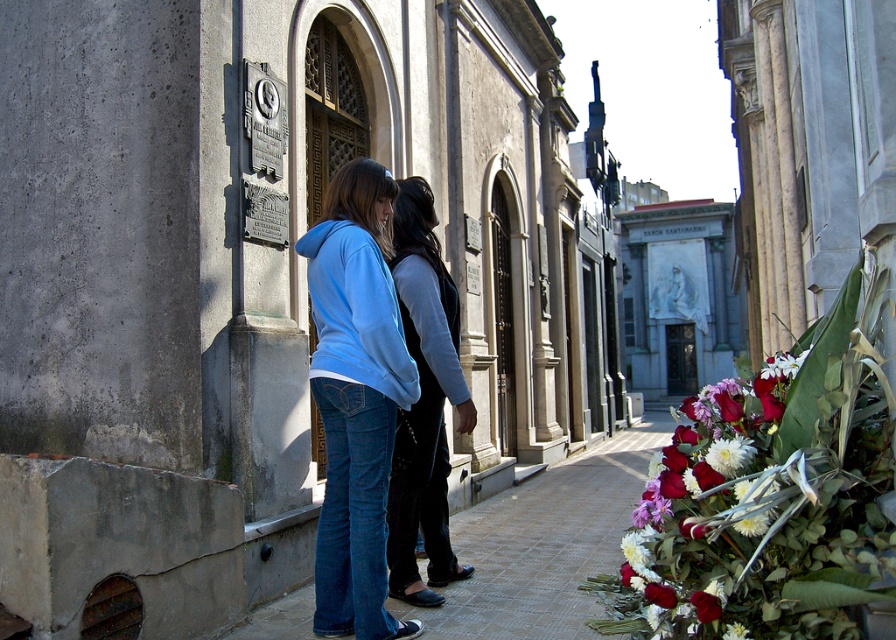
Can you confirm if denim jeans at center is positioned to the right of black leather jacket at center?

Yes, denim jeans at center is to the right of black leather jacket at center.

Who is positioned more to the left, denim jeans at center or black leather jacket at center?

black leather jacket at center is more to the left.

Is point (586, 497) behind point (448, 515)?

That is True.

This screenshot has height=640, width=896. Identify the location of denim jeans at center. (544, 544).

Who is more distant from viewer, (448, 348) or (341, 308)?

The point (448, 348) is more distant.

Does point (409, 582) lie behind point (369, 305)?

Yes, it is behind point (369, 305).

Is point (388, 500) in front of point (354, 225)?

No, it is not.

Where is `black leather jacket at center`? black leather jacket at center is located at coordinates (423, 401).

Is light blue hoodie at center taller than denim jeans at center?

Indeed, light blue hoodie at center has a greater height compared to denim jeans at center.

Which is above, light blue hoodie at center or denim jeans at center?

light blue hoodie at center is above.

Between point (328, 243) and point (446, 596), which one is positioned in front?

Point (328, 243) is more forward.

Locate an element on the screen. light blue hoodie at center is located at coordinates (356, 396).